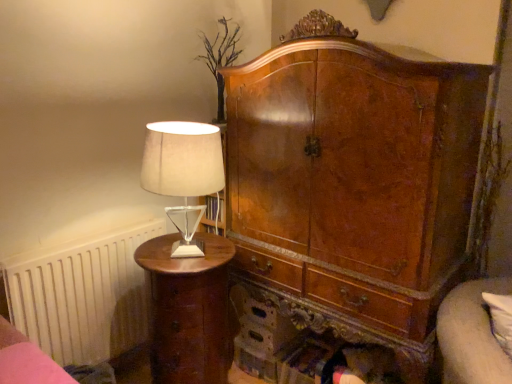
Question: Considering the positions of satin beige lampshade at left and wooden bed frame at lower left in the image, is satin beige lampshade at left taller or shorter than wooden bed frame at lower left?

Choices:
 (A) short
 (B) tall

Answer: (B)

Question: From the image's perspective, is satin beige lampshade at left located above or below wooden bed frame at lower left?

Choices:
 (A) below
 (B) above

Answer: (B)

Question: Estimate the real-world distances between objects in this image. Which object is farther from the matte brown nightstand at left?

Choices:
 (A) satin beige lampshade at left
 (B) wooden bed frame at lower left
 (C) velvet beige couch at lower right
 (D) white matte radiator at left

Answer: (C)

Question: Which object is positioned closest to the white matte radiator at left?

Choices:
 (A) velvet beige couch at lower right
 (B) satin beige lampshade at left
 (C) matte brown nightstand at left
 (D) wooden bed frame at lower left

Answer: (C)